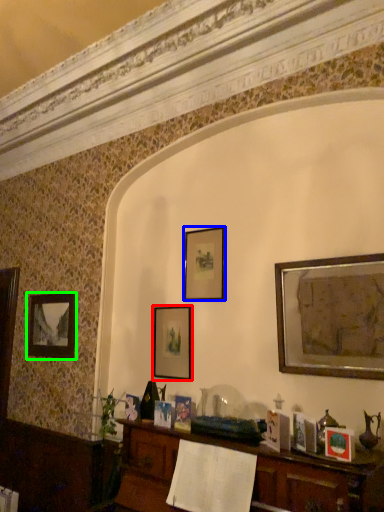
Question: Considering the real-world distances, which object is closest to picture frame (highlighted by a red box)? picture frame (highlighted by a blue box) or picture frame (highlighted by a green box).

Choices:
 (A) picture frame
 (B) picture frame

Answer: (A)